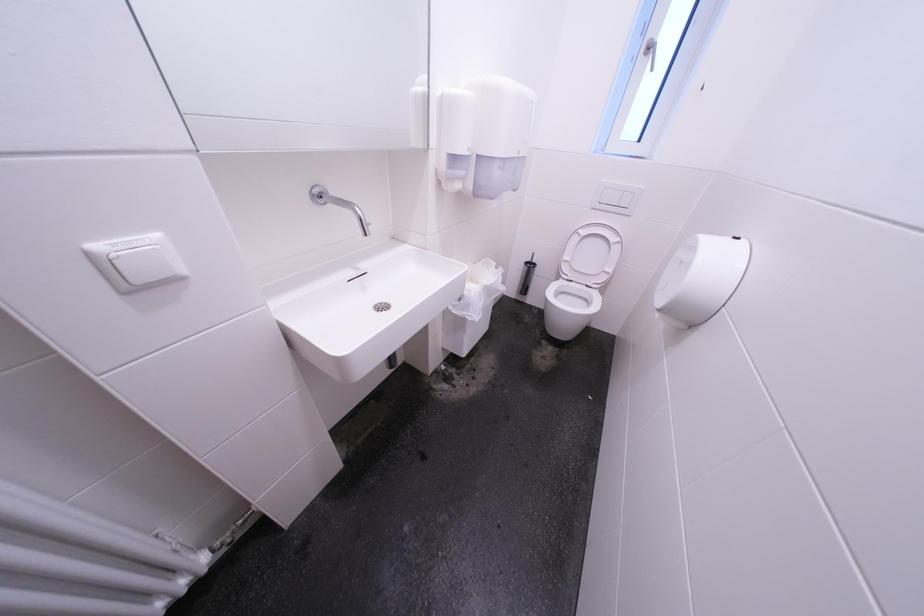
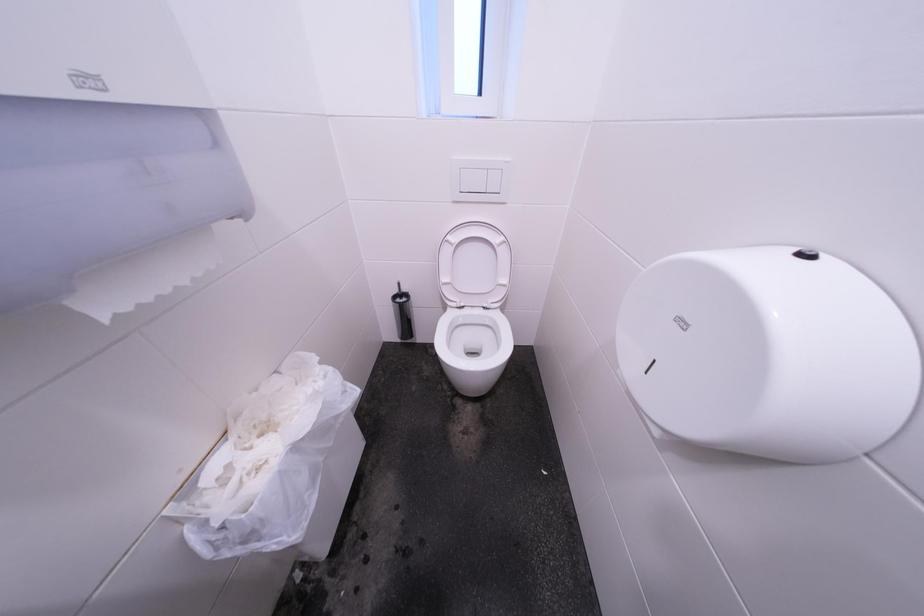
The images are taken continuously from a first-person perspective. In which direction are you moving?

The cameraman walked toward right, forward.